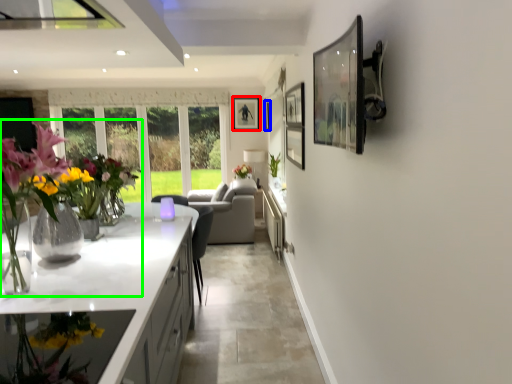
Question: Which is farther away from picture frame (highlighted by a red box)? picture frame (highlighted by a blue box) or floral arrangement (highlighted by a green box)?

Choices:
 (A) picture frame
 (B) floral arrangement

Answer: (B)